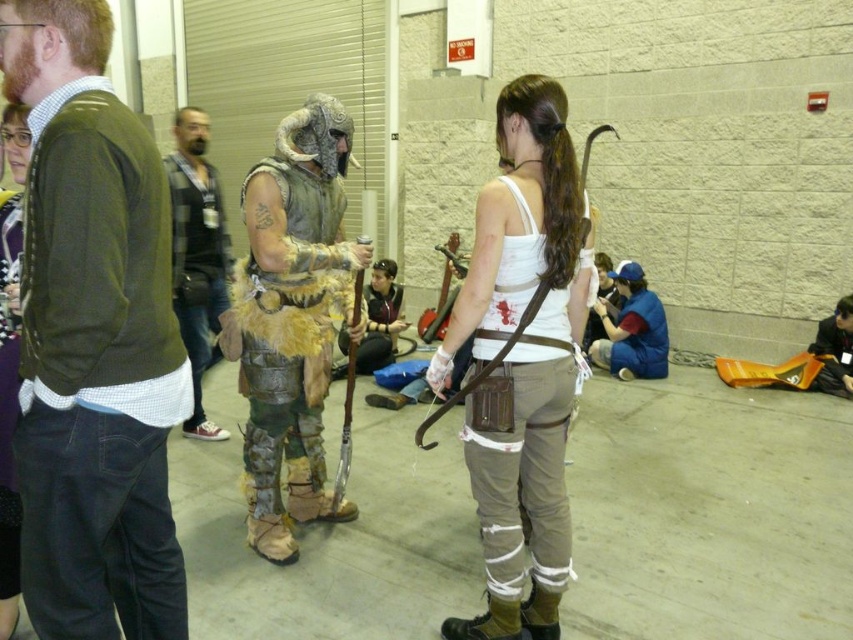
Question: Is green sweater at center wider than white matte tank top at center?

Choices:
 (A) no
 (B) yes

Answer: (A)

Question: Estimate the real-world distances between objects in this image. Which object is closer to the leather fur armor at center?

Choices:
 (A) blue fabric shirt at lower right
 (B) matte purple sweater at upper left

Answer: (B)

Question: Is white matte tank top at center smaller than leather fur armor at center?

Choices:
 (A) no
 (B) yes

Answer: (A)

Question: Which point appears farthest from the camera in this image?

Choices:
 (A) (479, 484)
 (B) (631, 323)
 (C) (306, 182)
 (D) (28, 144)

Answer: (B)

Question: Among these objects, which one is nearest to the camera?

Choices:
 (A) dark gray flannel shirt at left
 (B) matte purple sweater at upper left
 (C) green sweater at center
 (D) blue fabric shirt at lower right

Answer: (C)

Question: Can you confirm if green sweater at center is positioned to the left of dark gray flannel shirt at left?

Choices:
 (A) no
 (B) yes

Answer: (A)